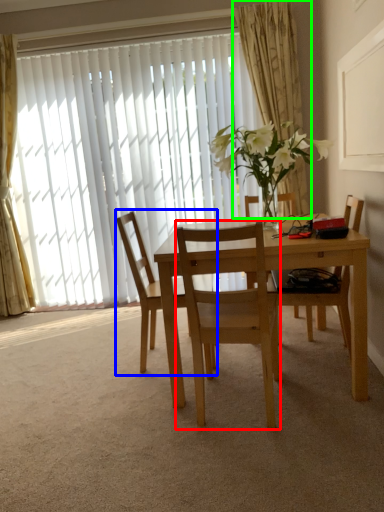
Question: Which object is positioned closest to chair (highlighted by a red box)? Select from chair (highlighted by a blue box) and curtain (highlighted by a green box).

Choices:
 (A) chair
 (B) curtain

Answer: (A)